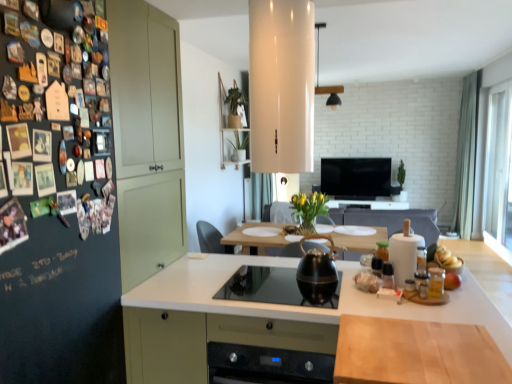
Question: Is black glossy tv at center to the left of dark matte board at left from the viewer's perspective?

Choices:
 (A) yes
 (B) no

Answer: (B)

Question: Can you confirm if black glossy tv at center is positioned to the right of dark matte board at left?

Choices:
 (A) no
 (B) yes

Answer: (B)

Question: From a real-world perspective, is black glossy tv at center physically above dark matte board at left?

Choices:
 (A) yes
 (B) no

Answer: (B)

Question: Does black glossy tv at center have a greater width compared to dark matte board at left?

Choices:
 (A) yes
 (B) no

Answer: (B)

Question: From the image's perspective, is black glossy tv at center beneath dark matte board at left?

Choices:
 (A) no
 (B) yes

Answer: (A)

Question: Considering the relative positions of black glossy tv at center and dark matte board at left in the image provided, is black glossy tv at center behind dark matte board at left?

Choices:
 (A) no
 (B) yes

Answer: (B)

Question: Can you confirm if yellow matte bananas at right, which ranks as the 2th food in bottom-to-top order, is shorter than transparent glass window at right?

Choices:
 (A) yes
 (B) no

Answer: (A)

Question: Is yellow matte bananas at right, which is counted as the second food, starting from the front, turned away from transparent glass window at right?

Choices:
 (A) yes
 (B) no

Answer: (A)

Question: Is yellow matte bananas at right, which ranks as the first food in back-to-front order, outside of transparent glass window at right?

Choices:
 (A) no
 (B) yes

Answer: (B)

Question: From the image's perspective, is yellow matte bananas at right, which is counted as the second food, starting from the front, on transparent glass window at right?

Choices:
 (A) no
 (B) yes

Answer: (A)

Question: Is yellow matte bananas at right, which ranks as the 2th food in bottom-to-top order, surrounding transparent glass window at right?

Choices:
 (A) no
 (B) yes

Answer: (A)

Question: Considering the relative sizes of yellow matte bananas at right, which is counted as the second food, starting from the front, and transparent glass window at right in the image provided, is yellow matte bananas at right, which is counted as the second food, starting from the front, taller than transparent glass window at right?

Choices:
 (A) no
 (B) yes

Answer: (A)

Question: Considering the relative sizes of shiny black kettle at center and yellow matte bananas at right, which ranks as the first food in back-to-front order, in the image provided, is shiny black kettle at center taller than yellow matte bananas at right, which ranks as the first food in back-to-front order,?

Choices:
 (A) yes
 (B) no

Answer: (A)